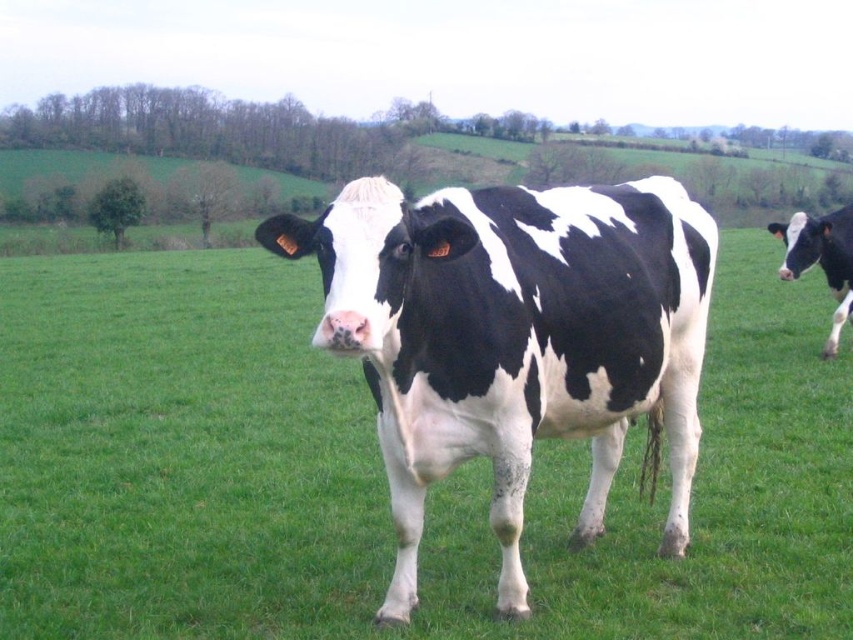
You are a farmer checking your herd in the field. You see the black and white spotted cow at center and the black and white cow at right. Which cow is positioned more to the left side of the field?

The black and white spotted cow at center is positioned more to the left side of the field than the black and white cow at right.

You are a photographer taking a picture of the cows in the field. You want to focus on the cow that is closer to you. Which cow should you choose between the black and white spotted cow at center and the black and white cow at right?

The black and white spotted cow at center is closer to the viewer than the black and white cow at right, so you should focus on the black and white spotted cow at center.

You are standing in the field and want to reach the point at coordinates (397, 525). The cow is blocking your path. Can you walk around the cow to reach that point?

The point at coordinates (397, 525) is 11.86 feet away from you. Since the cow is blocking your path, you can walk around it to reach the point as long as there is enough space to maneuver around the cow.